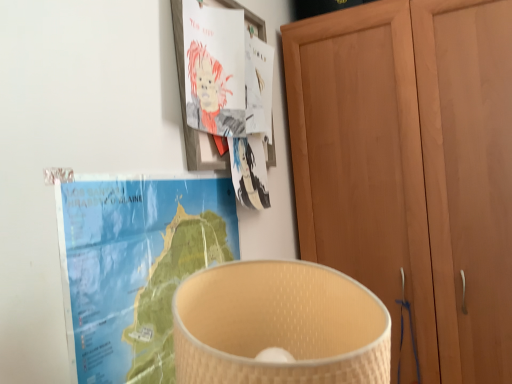
What are the coordinates of `wooden cupboard at right` in the screenshot? It's located at (412, 167).

This screenshot has width=512, height=384. What do you see at coordinates (412, 167) in the screenshot?
I see `wooden cupboard at right` at bounding box center [412, 167].

Consider the image. Measure the distance between wooden cupboard at right and camera.

1.10 meters.

What is the approximate width of blue paper map at upper left?

It is 3.39 centimeters.

Locate an element on the screen. Image resolution: width=512 pixels, height=384 pixels. blue paper map at upper left is located at coordinates (135, 267).

The height and width of the screenshot is (384, 512). Describe the element at coordinates (135, 267) in the screenshot. I see `blue paper map at upper left` at that location.

Find the location of a particular element. The image size is (512, 384). wooden cupboard at right is located at coordinates (412, 167).

Which is more to the left, blue paper map at upper left or wooden cupboard at right?

Positioned to the left is blue paper map at upper left.

In the image, is blue paper map at upper left positioned in front of or behind wooden cupboard at right?

blue paper map at upper left is positioned closer to the viewer than wooden cupboard at right.

Which is closer, (207, 251) or (460, 229)?

Positioned in front is point (207, 251).

From the image's perspective, is blue paper map at upper left above or below wooden cupboard at right?

blue paper map at upper left is situated lower than wooden cupboard at right in the image.

From a real-world perspective, is blue paper map at upper left under wooden cupboard at right?

Incorrect, from a real-world perspective, blue paper map at upper left is higher than wooden cupboard at right.

Does blue paper map at upper left have a greater width compared to wooden cupboard at right?

In fact, blue paper map at upper left might be narrower than wooden cupboard at right.

In the scene shown: Which of these two, blue paper map at upper left or wooden cupboard at right, stands taller?

wooden cupboard at right is taller.

Considering the sizes of blue paper map at upper left and wooden cupboard at right in the image, is blue paper map at upper left bigger or smaller than wooden cupboard at right?

Clearly, blue paper map at upper left is smaller in size than wooden cupboard at right.

Does blue paper map at upper left contain wooden cupboard at right?

No, wooden cupboard at right is located outside of blue paper map at upper left.

Would you say blue paper map at upper left is a long distance from wooden cupboard at right?

No, blue paper map at upper left is in close proximity to wooden cupboard at right.

Is blue paper map at upper left oriented towards wooden cupboard at right?

No, blue paper map at upper left is not turned towards wooden cupboard at right.

Measure the distance from blue paper map at upper left to wooden cupboard at right.

blue paper map at upper left is 26.10 inches away from wooden cupboard at right.

You are a GUI agent. You are given a task and a screenshot of the screen. Output one action in this format:
    pyautogui.click(x=<x>, y=<y>)
    Task: Click on the paperback book in front of the wooden cupboard at right
    The image size is (512, 384).
    Given the screenshot: What is the action you would take?
    pyautogui.click(x=135, y=267)

In the image, is wooden cupboard at right on the left side or the right side of blue paper map at upper left?

In the image, wooden cupboard at right appears on the right side of blue paper map at upper left.

Relative to blue paper map at upper left, is wooden cupboard at right in front or behind?

In the image, wooden cupboard at right appears behind blue paper map at upper left.

Which is in front, point (500, 347) or point (89, 349)?

The point (89, 349) is closer.

From the image's perspective, does wooden cupboard at right appear higher than blue paper map at upper left?

Indeed, from the image's perspective, wooden cupboard at right is shown above blue paper map at upper left.

From a real-world perspective, which object rests below the other?

In real-world perspective, wooden cupboard at right is lower.

Considering the sizes of objects wooden cupboard at right and blue paper map at upper left in the image provided, who is thinner, wooden cupboard at right or blue paper map at upper left?

blue paper map at upper left is thinner.

Which of these two, wooden cupboard at right or blue paper map at upper left, stands taller?

Standing taller between the two is wooden cupboard at right.

In terms of size, does wooden cupboard at right appear bigger or smaller than blue paper map at upper left?

wooden cupboard at right is bigger than blue paper map at upper left.

Is wooden cupboard at right not within blue paper map at upper left?

Yes, wooden cupboard at right is outside of blue paper map at upper left.

Is wooden cupboard at right positioned far away from blue paper map at upper left?

wooden cupboard at right is near blue paper map at upper left, not far away.

Is wooden cupboard at right facing away from blue paper map at upper left?

No, wooden cupboard at right's orientation is not away from blue paper map at upper left.

How many degrees apart are the facing directions of wooden cupboard at right and blue paper map at upper left?

The facing directions of wooden cupboard at right and blue paper map at upper left are 89.6 degrees apart.

I want to click on paperback book in front of the wooden cupboard at right, so click(x=135, y=267).

Where is `cupboard above the blue paper map at upper left (from the image's perspective)`? cupboard above the blue paper map at upper left (from the image's perspective) is located at coordinates (412, 167).

Find the location of a particular element. This screenshot has width=512, height=384. cupboard below the blue paper map at upper left (from a real-world perspective) is located at coordinates (412, 167).